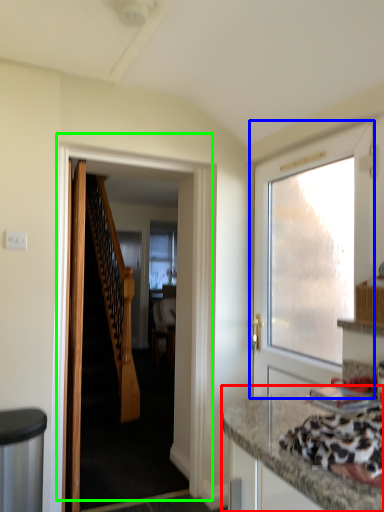
Question: Considering the real-world distances, which object is closest to countertop (highlighted by a red box)? door (highlighted by a blue box) or door (highlighted by a green box).

Choices:
 (A) door
 (B) door

Answer: (A)